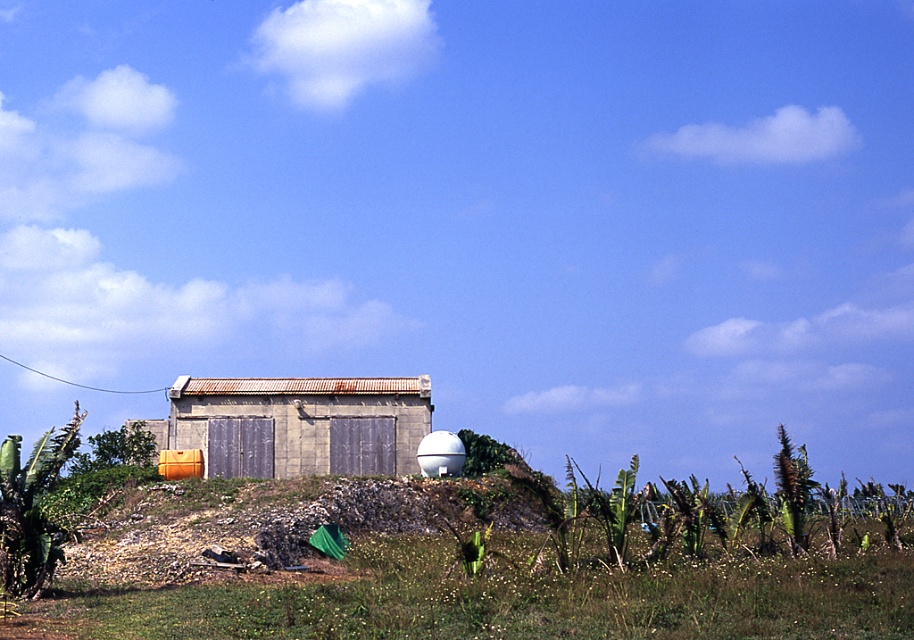
Question: Which object is positioned farthest from the green grass at lower center?

Choices:
 (A) rusty concrete hut at center
 (B) white matte water tank at center

Answer: (A)

Question: Does green grass at lower center have a smaller size compared to rusty concrete hut at center?

Choices:
 (A) no
 (B) yes

Answer: (B)

Question: Which object is positioned farthest from the white matte water tank at center?

Choices:
 (A) green grass at lower center
 (B) rusty concrete hut at center

Answer: (A)

Question: Where is rusty concrete hut at center located in relation to white matte water tank at center in the image?

Choices:
 (A) above
 (B) below

Answer: (A)

Question: Is green grass at lower center wider than white matte water tank at center?

Choices:
 (A) no
 (B) yes

Answer: (B)

Question: Which object appears closest to the camera in this image?

Choices:
 (A) rusty concrete hut at center
 (B) green grass at lower center

Answer: (B)